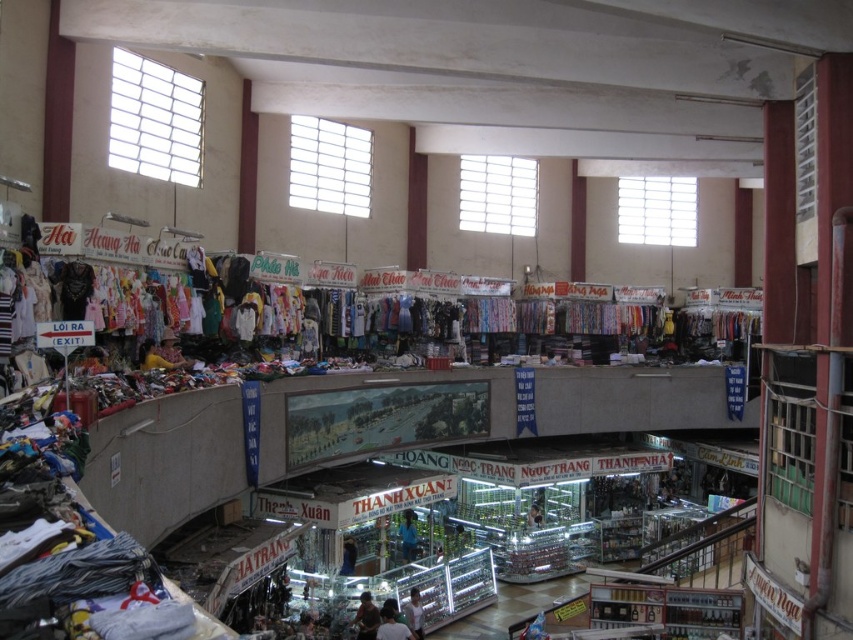
Which of these two, light brown fabric shirt at lower center or light brown leather jacket at center, stands shorter?

light brown fabric shirt at lower center

Is light brown fabric shirt at lower center wider than light brown leather jacket at center?

Indeed, light brown fabric shirt at lower center has a greater width compared to light brown leather jacket at center.

Is point (404, 634) positioned after point (529, 518)?

No, (404, 634) is closer to viewer.

Where is `light brown fabric shirt at lower center`? The image size is (853, 640). light brown fabric shirt at lower center is located at coordinates (392, 627).

Who is taller, brown fabric person at center or light brown leather jacket at center?

With more height is brown fabric person at center.

Is brown fabric person at center below light brown leather jacket at center?

Indeed, brown fabric person at center is positioned under light brown leather jacket at center.

I want to click on brown fabric person at center, so click(366, 618).

Who is positioned more to the right, brown fabric person at center or light brown fabric shirt at lower center?

light brown fabric shirt at lower center is more to the right.

Who is shorter, brown fabric person at center or light brown fabric shirt at lower center?

light brown fabric shirt at lower center is shorter.

Where is `brown fabric person at center`? Image resolution: width=853 pixels, height=640 pixels. brown fabric person at center is located at coordinates (366, 618).